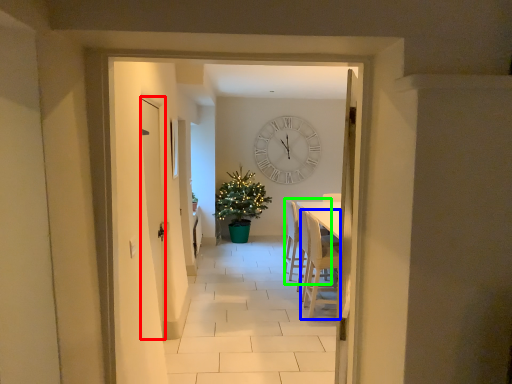
Question: Estimate the real-world distances between objects in this image. Which object is farther from door (highlighted by a red box), armchair (highlighted by a blue box) or armchair (highlighted by a green box)?

Choices:
 (A) armchair
 (B) armchair

Answer: (B)